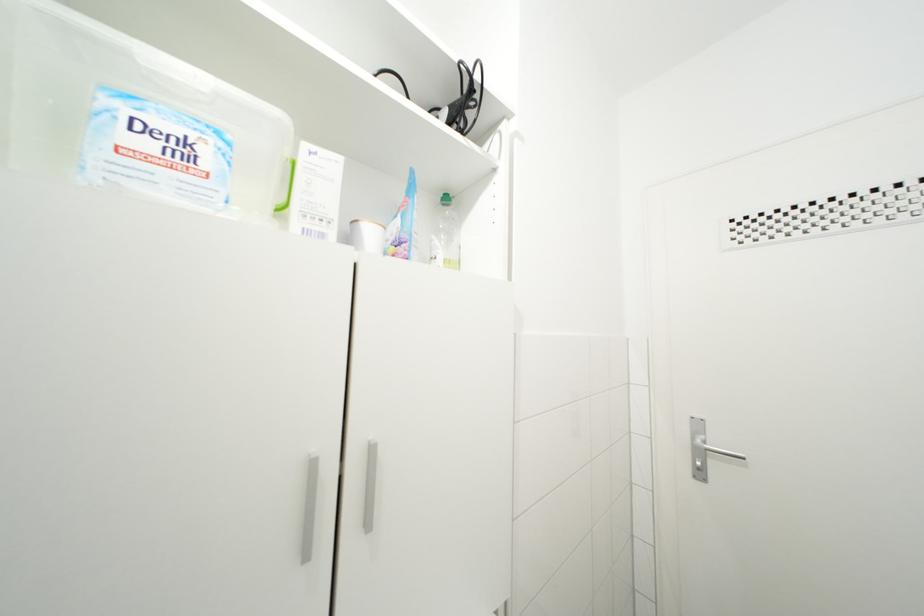
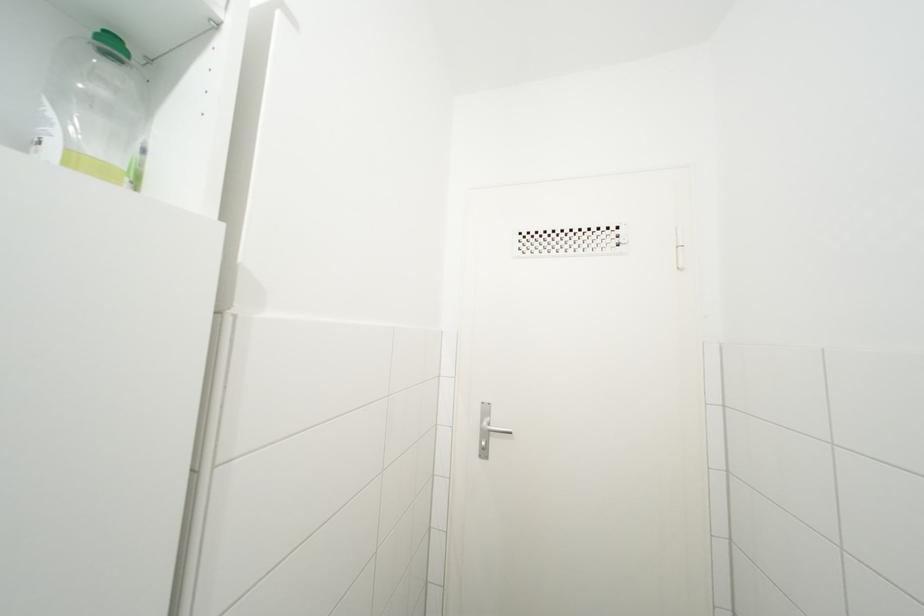
Find the pixel in the second image that matches point (451, 204) in the first image.

(117, 51)